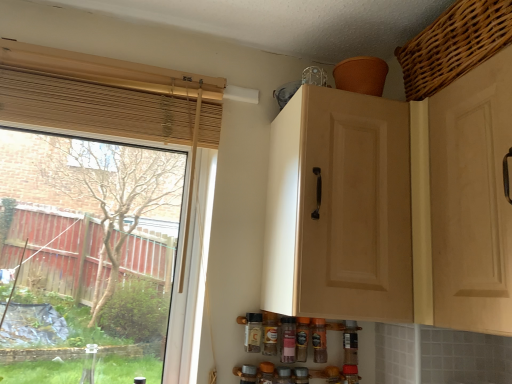
Question: Is point (288, 359) closer or farther from the camera than point (355, 233)?

Choices:
 (A) closer
 (B) farther

Answer: (B)

Question: Considering the positions of translucent plastic spice bottle at lower center, the 3th bottle when ordered from right to left, and matte wood cabinet at upper center in the image, is translucent plastic spice bottle at lower center, the 3th bottle when ordered from right to left, taller or shorter than matte wood cabinet at upper center?

Choices:
 (A) tall
 (B) short

Answer: (B)

Question: Which is farther from the matte wood cabinet at upper center?

Choices:
 (A) transparent glass window at left
 (B) matte glass spice bottle at lower center, the 5th bottle in the right-to-left sequence
 (C) brown glass spice bottle at center, the 2th bottle from the right
 (D) translucent plastic spice bottle at lower center, the 3th bottle in the left-to-right sequence
 (E) woven brown basket at upper right

Answer: (B)

Question: Estimate the real-world distances between objects in this image. Which object is farther from the woven brown basket at upper right?

Choices:
 (A) brown glass spice bottle at center, the 2th bottle from the right
 (B) translucent plastic spice bottle at center, which is counted as the fourth bottle, starting from the right
 (C) brown glass spice bottle at lower center, the 5th bottle from the left
 (D) matte glass spice bottle at lower center, placed as the first bottle when sorted from left to right
 (E) translucent plastic spice bottle at lower center, the 3th bottle in the left-to-right sequence

Answer: (D)